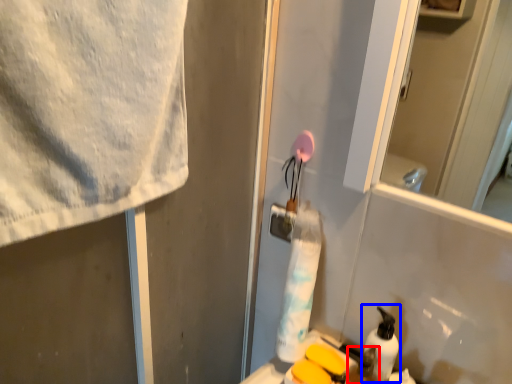
Question: Which object appears farthest to the camera in this image, toiletry (highlighted by a red box) or cleaning product (highlighted by a blue box)?

Choices:
 (A) toiletry
 (B) cleaning product

Answer: (B)